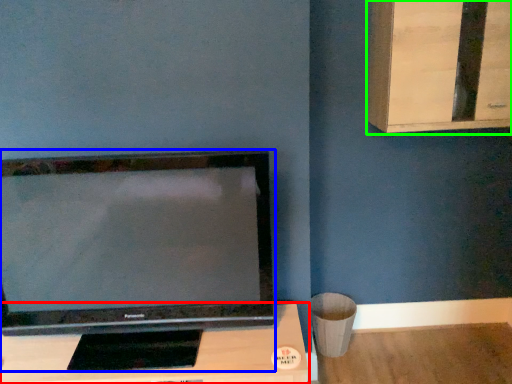
Question: Based on their relative distances, which object is nearer to furniture (highlighted by a red box)? Choose from television (highlighted by a blue box) and dresser (highlighted by a green box).

Choices:
 (A) television
 (B) dresser

Answer: (A)